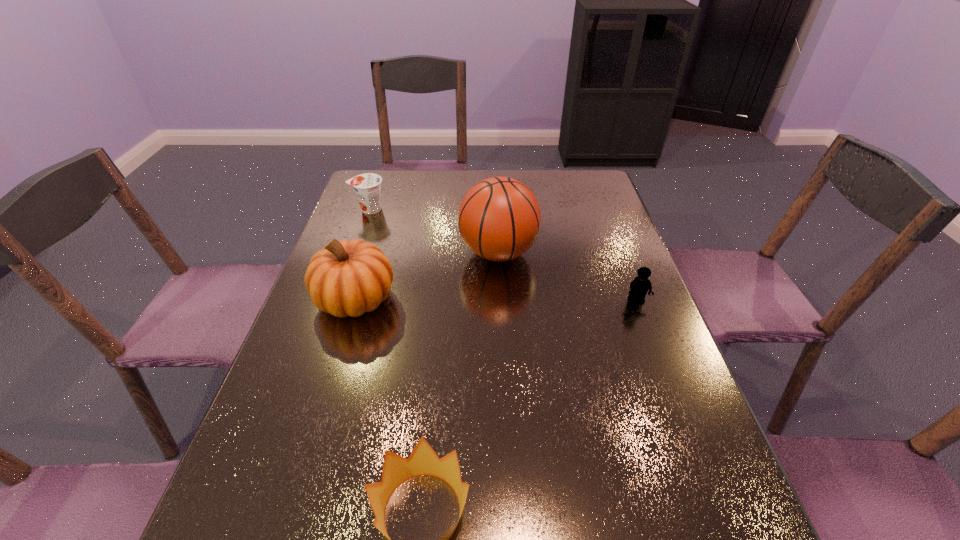
I want to click on the fourth closest object to the tallest object, so click(423, 460).

I want to click on free spot that satisfies the following two spatial constraints: 1. on the back side of the pumpkin; 2. on the right side of the tallest object, so click(370, 253).

What are the coordinates of `vacant space that satisfies the following two spatial constraints: 1. on the front side of the farthest object; 2. on the left side of the pumpkin` in the screenshot? It's located at (338, 299).

Where is `vacant region that satisfies the following two spatial constraints: 1. on the back side of the fourth shortest object; 2. on the right side of the tallest object`? This screenshot has width=960, height=540. vacant region that satisfies the following two spatial constraints: 1. on the back side of the fourth shortest object; 2. on the right side of the tallest object is located at coordinates (370, 253).